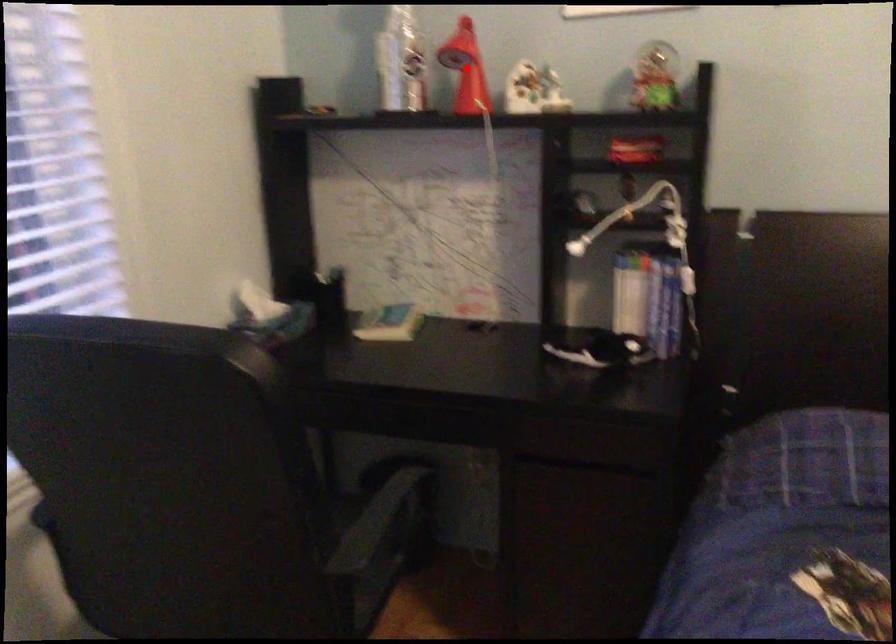
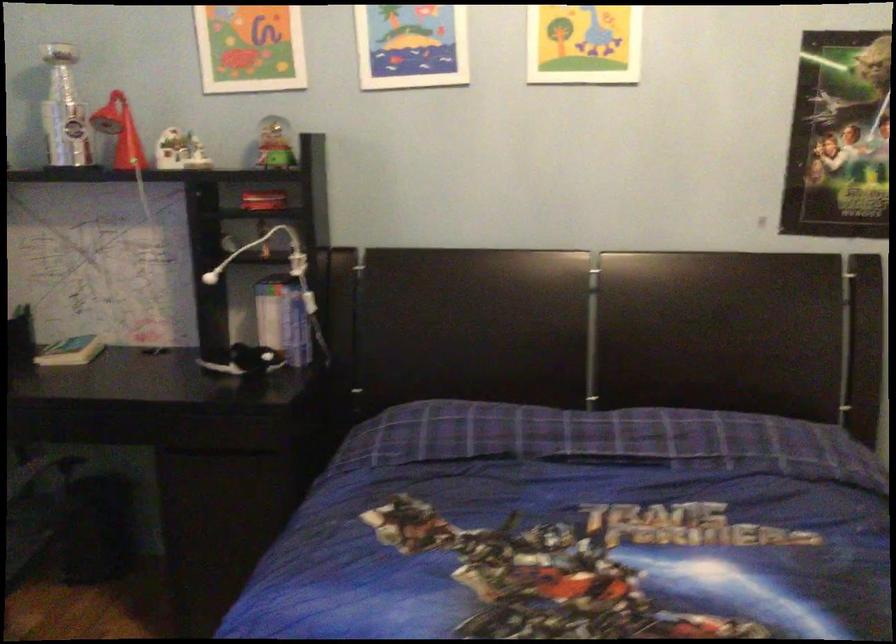
Find the pixel in the second image that matches the highlighted location in the first image.

(119, 131)